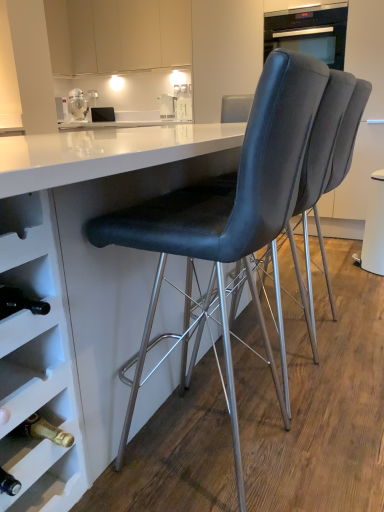
Question: Visually, is white matte drawer at lower left positioned to the left or to the right of white glossy table at center?

Choices:
 (A) right
 (B) left

Answer: (B)

Question: Would you say white matte drawer at lower left is inside or outside white glossy table at center?

Choices:
 (A) outside
 (B) inside

Answer: (B)

Question: Estimate the real-world distances between objects in this image. Which object is closer to the matte black chair at center, which is counted as the first chair, starting from the back?

Choices:
 (A) matte white cabinets at upper center
 (B) white glossy table at center
 (C) matte black chair at center, which ranks as the third chair in back-to-front order
 (D) white matte drawer at lower left
 (E) metallic silver blender at upper left

Answer: (C)

Question: Estimate the real-world distances between objects in this image. Which object is farther from the black glass oven at upper right?

Choices:
 (A) white glossy table at center
 (B) metallic silver blender at upper left
 (C) matte black chair at center, the 1th chair from the front
 (D) matte white cabinets at upper center
 (E) white matte drawer at lower left

Answer: (E)